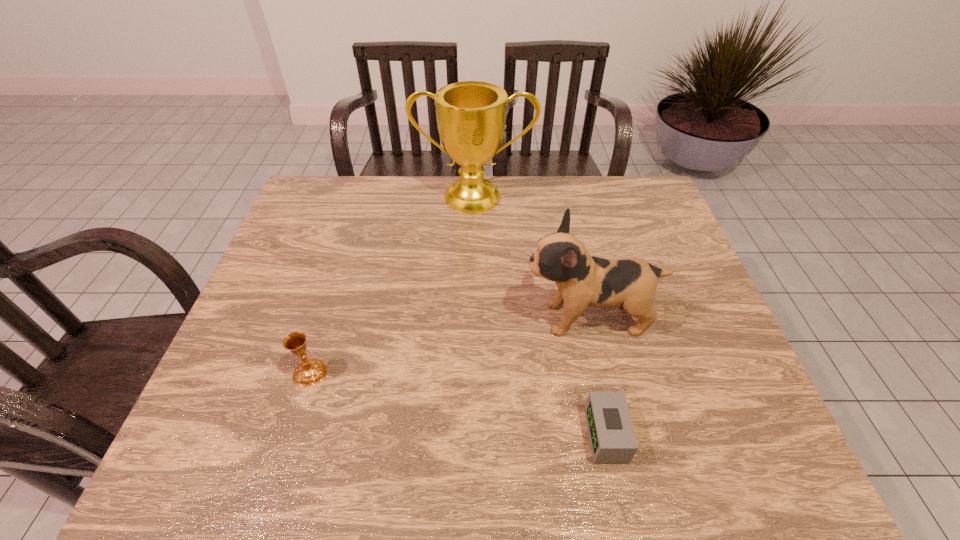
The image size is (960, 540). I want to click on free space located 0.340m at the face of the second tallest object, so click(387, 319).

Where is `vacant space located 0.400m at the face of the second tallest object`? This screenshot has width=960, height=540. vacant space located 0.400m at the face of the second tallest object is located at coordinates (363, 319).

Image resolution: width=960 pixels, height=540 pixels. I want to click on vacant region located 0.090m on the front of the chalice, so click(x=294, y=427).

You are a GUI agent. You are given a task and a screenshot of the screen. Output one action in this format:
    pyautogui.click(x=<x>, y=<y>)
    Task: Click on the vacant point located on the front-facing side of the shortest object
    The width and height of the screenshot is (960, 540).
    Given the screenshot: What is the action you would take?
    pyautogui.click(x=494, y=435)

The height and width of the screenshot is (540, 960). Find the location of `free point located 0.170m on the front-facing side of the shortest object`. free point located 0.170m on the front-facing side of the shortest object is located at coordinates (505, 435).

Identify the location of free point located 0.230m on the front-facing side of the shortest object. (475, 435).

Image resolution: width=960 pixels, height=540 pixels. Find the location of `object that is at the far edge`. object that is at the far edge is located at coordinates (471, 115).

Find the location of a particular element. This screenshot has height=540, width=960. object situated at the near edge is located at coordinates tap(612, 438).

I want to click on object that is at the right edge, so click(582, 280).

This screenshot has height=540, width=960. In the image, there is a desktop. Find the location of `vacant region at the far edge`. vacant region at the far edge is located at coordinates (511, 177).